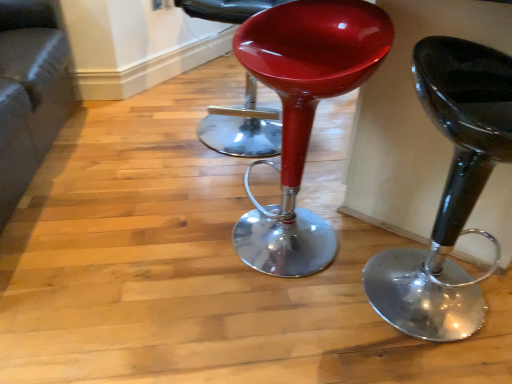
The height and width of the screenshot is (384, 512). I want to click on free space between glossy plastic stool at center, the 1th stool in the right-to-left sequence, and glossy plastic stool at center, which is counted as the 1th stool, starting from the left, so click(340, 261).